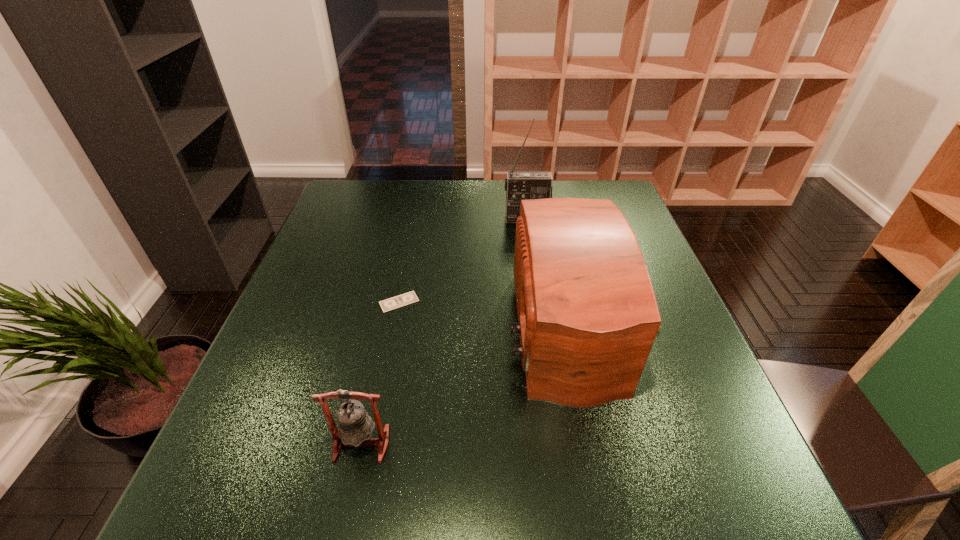
Where is `free space located on the front-facing side of the nearer radio receiver`? The width and height of the screenshot is (960, 540). free space located on the front-facing side of the nearer radio receiver is located at coordinates (423, 327).

At what (x,y) coordinates should I click in order to perform the action: click on free spot located on the back of the nearest object. Please return your answer as a coordinate pair (x, y). This screenshot has height=540, width=960. Looking at the image, I should click on (387, 327).

In order to click on free region located 0.260m on the right of the shortest object in this screenshot , I will do `click(529, 302)`.

Where is `object present at the far edge`? object present at the far edge is located at coordinates (519, 186).

At what (x,y) coordinates should I click in order to perform the action: click on object that is at the right edge. Please return your answer as a coordinate pair (x, y). Looking at the image, I should click on (587, 313).

At what (x,y) coordinates should I click in order to perform the action: click on vacant space at the far edge of the desktop. Please return your answer as a coordinate pair (x, y). The height and width of the screenshot is (540, 960). Looking at the image, I should click on (405, 186).

Locate an element on the screen. This screenshot has width=960, height=540. free space at the near edge of the desktop is located at coordinates point(525,530).

Where is `vacant space at the left edge of the desktop`? The width and height of the screenshot is (960, 540). vacant space at the left edge of the desktop is located at coordinates (346, 277).

Find the location of a particular element. The image size is (960, 540). vacant space at the right edge is located at coordinates (712, 451).

The width and height of the screenshot is (960, 540). In the image, there is a desktop. In order to click on vacant space at the far left corner in this screenshot , I will do `click(369, 185)`.